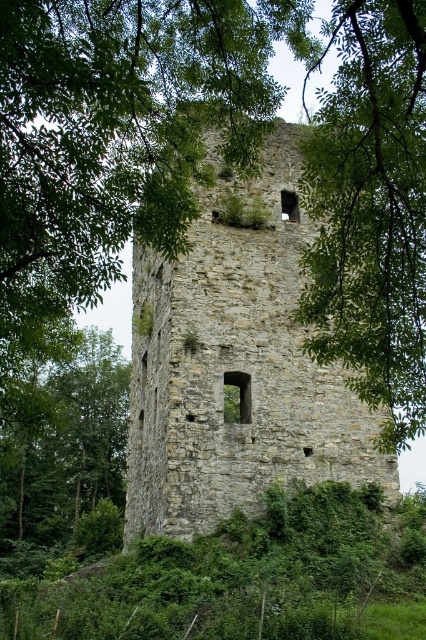
From the picture: You are standing in a forest and see a point marked at coordinates (236, 365). According to the scene description, what is located at that point?

The point at coordinates (236, 365) marks the location of the stone tower at center.

You are standing in a forest clearing and see the stone tower at center and the green leafy tree at left. Which object is closer to you?

The stone tower at center is closer to you because it is positioned further to the viewer than the green leafy tree at left, meaning it appears nearer in the scene.